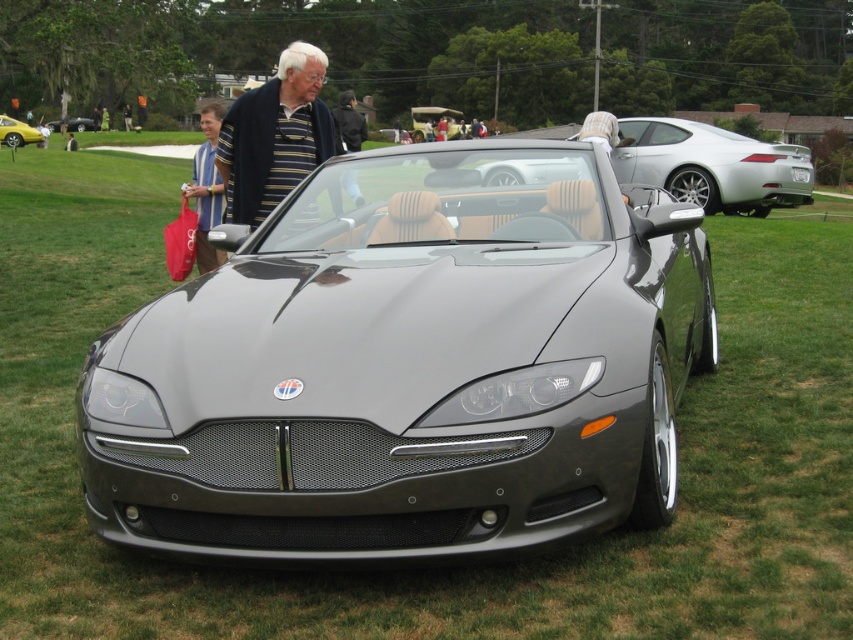
Question: Which point is closer to the camera?

Choices:
 (A) satin silver convertible at center
 (B) striped sweater at center
 (C) yellow metallic car at upper left

Answer: (B)

Question: Is satin silver convertible at center positioned before matte black convertible at center?

Choices:
 (A) yes
 (B) no

Answer: (A)

Question: Among these objects, which one is farthest from the camera?

Choices:
 (A) matte black convertible at center
 (B) striped sweater at center

Answer: (A)

Question: In this image, where is satin silver convertible at center located relative to yellow metallic car at upper left?

Choices:
 (A) left
 (B) right

Answer: (B)

Question: Based on their relative distances, which object is nearer to the satin silver convertible at center?

Choices:
 (A) yellow metallic car at upper left
 (B) matte black convertible at center
 (C) striped sweater at center

Answer: (C)

Question: Is yellow metallic car at upper left wider than matte black convertible at center?

Choices:
 (A) no
 (B) yes

Answer: (B)